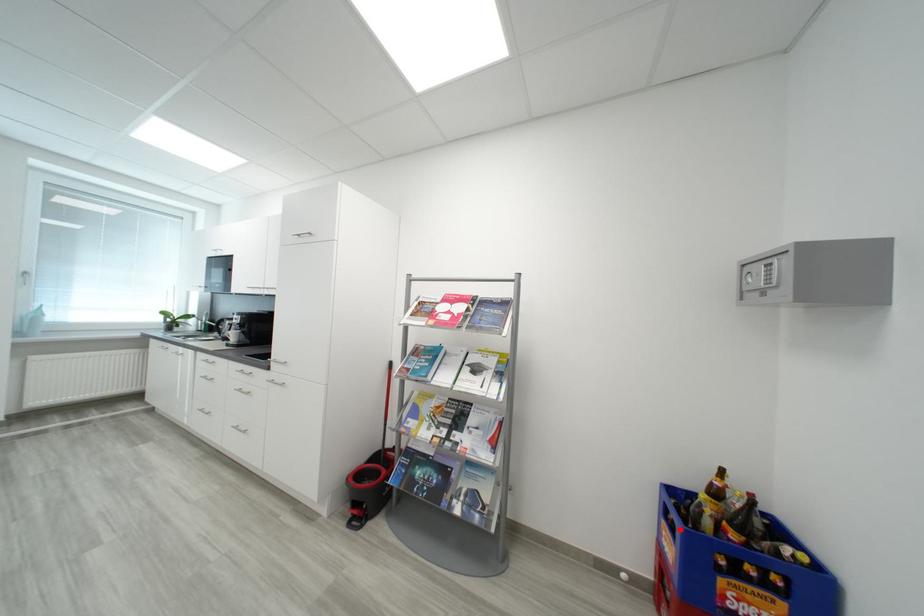
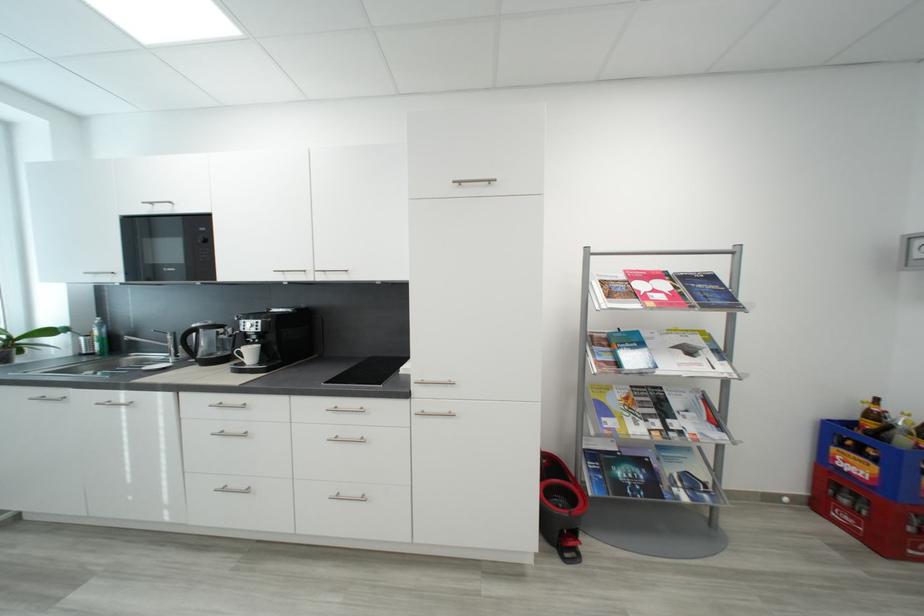
The point at the highlighted location is marked in the first image. Where is the corresponding point in the second image?

(867, 454)